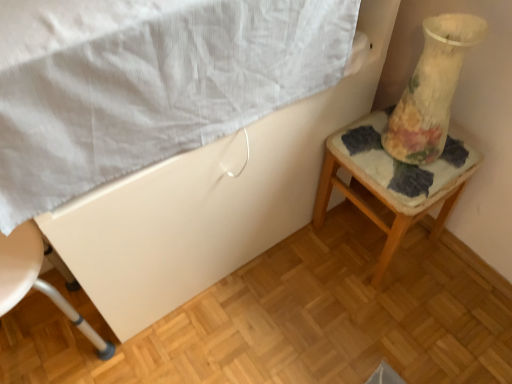
The height and width of the screenshot is (384, 512). In order to click on white plastic chair at lower left in this screenshot , I will do [x=36, y=280].

Describe the element at coordinates (390, 185) in the screenshot. The image size is (512, 384). I see `floral fabric cushion at right` at that location.

The height and width of the screenshot is (384, 512). In order to click on floral-patterned glass at right in this screenshot , I will do `click(431, 89)`.

Is white plastic chair at lower left thinner than floral fabric cushion at right?

Correct, the width of white plastic chair at lower left is less than that of floral fabric cushion at right.

Which is behind, point (50, 287) or point (444, 198)?

The point (444, 198) is behind.

Considering the positions of objects white plastic chair at lower left and floral fabric cushion at right in the image provided, who is more to the left, white plastic chair at lower left or floral fabric cushion at right?

From the viewer's perspective, white plastic chair at lower left appears more on the left side.

Looking at this image, is white plastic chair at lower left not near floral fabric cushion at right?

No.

Can you see floral-patterned glass at right touching white plastic chair at lower left?

No, floral-patterned glass at right is not in contact with white plastic chair at lower left.

Is point (473, 23) behind point (106, 347)?

No.

From a real-world perspective, is floral-patterned glass at right over white plastic chair at lower left?

Yes, from a real-world perspective, floral-patterned glass at right is above white plastic chair at lower left.

Considering the positions of objects floral-patterned glass at right and white plastic chair at lower left in the image provided, who is behind, floral-patterned glass at right or white plastic chair at lower left?

floral-patterned glass at right is further from the camera.

Is the position of white textured sheet at upper left less distant than that of floral fabric cushion at right?

Yes, it is.

From the image's perspective, which one is positioned higher, white textured sheet at upper left or floral fabric cushion at right?

From the image's view, white textured sheet at upper left is above.

From their relative heights in the image, would you say white textured sheet at upper left is taller or shorter than floral fabric cushion at right?

In the image, white textured sheet at upper left appears to be shorter than floral fabric cushion at right.

Would you say white textured sheet at upper left is outside floral fabric cushion at right?

Yes, white textured sheet at upper left is outside of floral fabric cushion at right.

Based on the photo, from the image's perspective, would you say white textured sheet at upper left is shown under white plastic chair at lower left?

No, from the image's perspective, white textured sheet at upper left is not beneath white plastic chair at lower left.

Which is more to the right, white textured sheet at upper left or white plastic chair at lower left?

Positioned to the right is white textured sheet at upper left.

Would you say white plastic chair at lower left is part of white textured sheet at upper left's contents?

No, white plastic chair at lower left is located outside of white textured sheet at upper left.

Looking at this image, could you tell me if white textured sheet at upper left is turned towards floral-patterned glass at right?

No, white textured sheet at upper left does not turn towards floral-patterned glass at right.

Would you say white textured sheet at upper left is a long distance from floral-patterned glass at right?

No, white textured sheet at upper left is in close proximity to floral-patterned glass at right.

Between white textured sheet at upper left and floral-patterned glass at right, which one is positioned behind?

floral-patterned glass at right is more distant.

Based on their positions, is white textured sheet at upper left located to the left or right of floral-patterned glass at right?

white textured sheet at upper left is to the left of floral-patterned glass at right.

Image resolution: width=512 pixels, height=384 pixels. I want to click on sheet on the left of floral fabric cushion at right, so click(146, 83).

Considering the positions of objects floral fabric cushion at right and white textured sheet at upper left in the image provided, who is in front, floral fabric cushion at right or white textured sheet at upper left?

white textured sheet at upper left is closer to the camera.

Looking at the image, does floral fabric cushion at right seem bigger or smaller compared to white textured sheet at upper left?

Clearly, floral fabric cushion at right is smaller in size than white textured sheet at upper left.

Is floral fabric cushion at right at the left side of white textured sheet at upper left?

In fact, floral fabric cushion at right is to the right of white textured sheet at upper left.

Where is `sheet that appears above the white plastic chair at lower left (from the image's perspective)`? Image resolution: width=512 pixels, height=384 pixels. sheet that appears above the white plastic chair at lower left (from the image's perspective) is located at coordinates (146, 83).

Is white plastic chair at lower left far away from white textured sheet at upper left?

That's not correct — white plastic chair at lower left is a little close to white textured sheet at upper left.

Considering the sizes of objects white plastic chair at lower left and white textured sheet at upper left in the image provided, who is bigger, white plastic chair at lower left or white textured sheet at upper left?

Bigger between the two is white textured sheet at upper left.

From a real-world perspective, which is physically above, white plastic chair at lower left or white textured sheet at upper left?

In real-world perspective, white textured sheet at upper left is above.

You are a GUI agent. You are given a task and a screenshot of the screen. Output one action in this format:
    pyautogui.click(x=<x>, y=<y>)
    Task: Click on the chair above the floral fabric cushion at right (from a real-world perspective)
    
    Given the screenshot: What is the action you would take?
    pyautogui.click(x=36, y=280)

At what (x,y) coordinates should I click in order to perform the action: click on chair located below the floral-patterned glass at right (from the image's perspective). Please return your answer as a coordinate pair (x, y). Looking at the image, I should click on (36, 280).

When comparing their distances from floral-patterned glass at right, does floral fabric cushion at right or white plastic chair at lower left seem further?

Based on the image, white plastic chair at lower left appears to be further to floral-patterned glass at right.

Considering their positions, is floral fabric cushion at right positioned closer to white textured sheet at upper left than floral-patterned glass at right?

floral-patterned glass at right.

When comparing their distances from white textured sheet at upper left, does white plastic chair at lower left or floral fabric cushion at right seem further?

floral fabric cushion at right lies further to white textured sheet at upper left than the other object.

Based on their spatial positions, is white plastic chair at lower left or white textured sheet at upper left closer to floral-patterned glass at right?

white textured sheet at upper left is closer to floral-patterned glass at right.

Which object lies nearer to the anchor point floral-patterned glass at right, white textured sheet at upper left or white plastic chair at lower left?

white textured sheet at upper left is positioned closer to the anchor floral-patterned glass at right.

Which object lies further to the anchor point floral-patterned glass at right, white textured sheet at upper left or floral fabric cushion at right?

Among the two, white textured sheet at upper left is located further to floral-patterned glass at right.

Looking at the image, which one is located closer to white textured sheet at upper left, white plastic chair at lower left or floral-patterned glass at right?

floral-patterned glass at right is closer to white textured sheet at upper left.

Looking at the image, which one is located closer to floral fabric cushion at right, floral-patterned glass at right or white plastic chair at lower left?

floral-patterned glass at right is closer to floral fabric cushion at right.

Where is `sheet located between white plastic chair at lower left and floral fabric cushion at right in the left-right direction`? sheet located between white plastic chair at lower left and floral fabric cushion at right in the left-right direction is located at coordinates (146, 83).

Locate an element on the screen. sheet between white plastic chair at lower left and floral-patterned glass at right from left to right is located at coordinates (146, 83).

Locate an element on the screen. The height and width of the screenshot is (384, 512). furniture situated between white textured sheet at upper left and floral-patterned glass at right from left to right is located at coordinates (390, 185).

What are the coordinates of `furniture between white plastic chair at lower left and floral-patterned glass at right` in the screenshot? It's located at (390, 185).